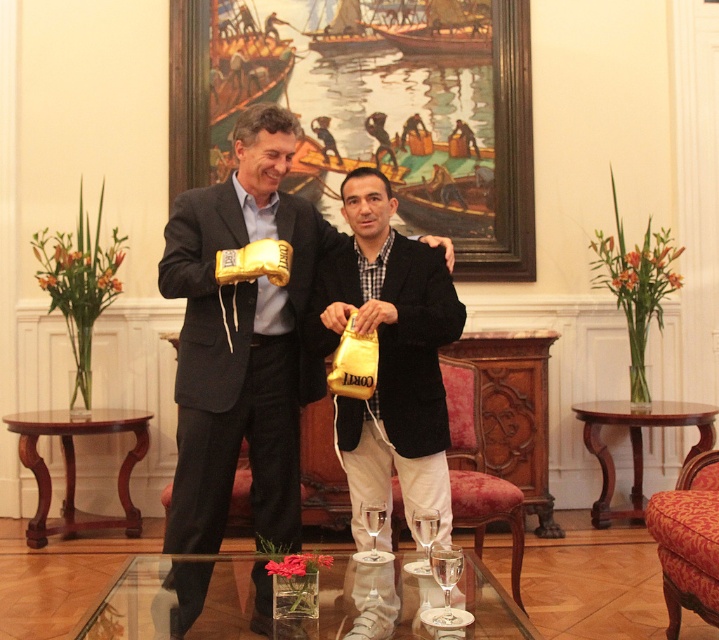
Question: Which object is farther from the camera taking this photo?

Choices:
 (A) gold metallic boxing glove at center
 (B) clear glass table at lower center
 (C) velvet upholstered armchair at center

Answer: (C)

Question: Which is nearer to the red fabric armchair at lower right?

Choices:
 (A) gold metallic boxing gloves at center
 (B) clear glass table at lower center

Answer: (B)

Question: Does clear glass table at lower center appear over velvet upholstered armchair at center?

Choices:
 (A) yes
 (B) no

Answer: (B)

Question: Which of the following is the closest to the observer?

Choices:
 (A) 668,566
 (B) 464,385
 (C) 124,566

Answer: (C)

Question: Does velvet upholstered armchair at center have a greater width compared to red fabric armchair at lower right?

Choices:
 (A) yes
 (B) no

Answer: (A)

Question: Is gold metallic boxing glove at center wider than clear glass table at lower center?

Choices:
 (A) no
 (B) yes

Answer: (A)